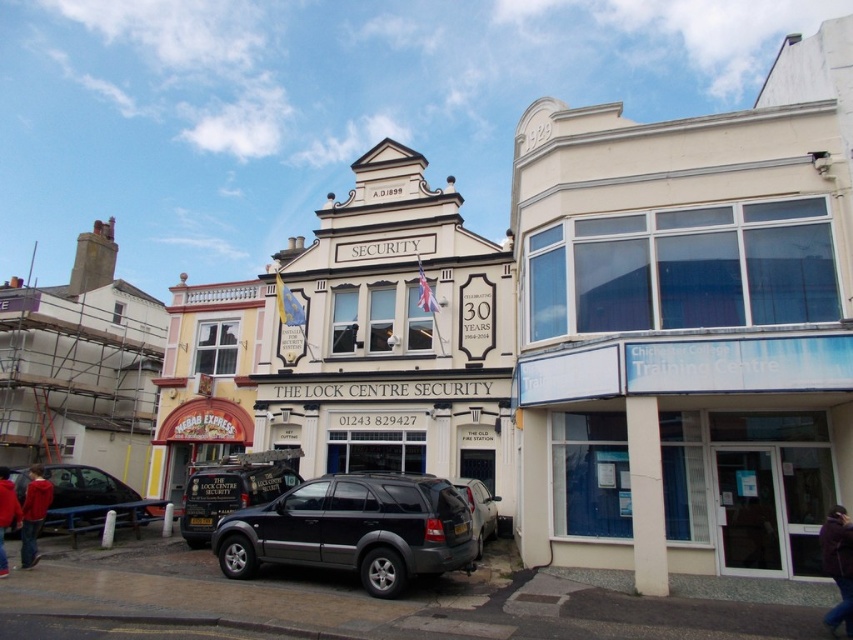
Is point (234, 500) farther from viewer compared to point (4, 560)?

Yes, point (234, 500) is behind point (4, 560).

You are a GUI agent. You are given a task and a screenshot of the screen. Output one action in this format:
    pyautogui.click(x=<x>, y=<y>)
    Task: Click on the matte black suv at center
    
    Given the screenshot: What is the action you would take?
    pyautogui.click(x=229, y=493)

Where is `matte black suv at center`? This screenshot has height=640, width=853. matte black suv at center is located at coordinates click(x=229, y=493).

Can you confirm if black matte suv at center is smaller than matte black suv at center?

Correct, black matte suv at center occupies less space than matte black suv at center.

Is black matte suv at center positioned before matte black suv at center?

Yes, it is.

The width and height of the screenshot is (853, 640). I want to click on black matte suv at center, so click(352, 529).

Who is shorter, shiny black car at lower left or red fleece jacket at lower left?

Standing shorter between the two is red fleece jacket at lower left.

Who is more forward, (102, 481) or (25, 529)?

Point (25, 529) is in front.

Where is `shiny black car at lower left`? The image size is (853, 640). shiny black car at lower left is located at coordinates (91, 499).

At what (x,y) coordinates should I click in order to perform the action: click on shiny black car at lower left. Please return your answer as a coordinate pair (x, y). The image size is (853, 640). Looking at the image, I should click on (91, 499).